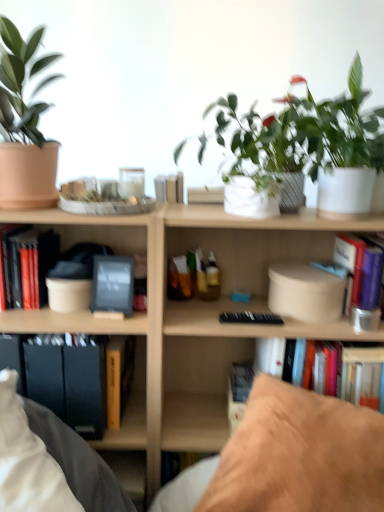
Question: Does green matte plant at upper right, the 2th houseplant when ordered from left to right, lie in front of white matte flowerpot at center?

Choices:
 (A) yes
 (B) no

Answer: (A)

Question: Is green matte plant at upper right, the 2th houseplant when ordered from left to right, taller than white matte flowerpot at center?

Choices:
 (A) no
 (B) yes

Answer: (B)

Question: Is the position of green matte plant at upper right, the 2th houseplant when ordered from left to right, more distant than that of white matte flowerpot at center?

Choices:
 (A) yes
 (B) no

Answer: (B)

Question: Can you confirm if green matte plant at upper right, arranged as the first houseplant when viewed from the right, is smaller than white matte flowerpot at center?

Choices:
 (A) no
 (B) yes

Answer: (A)

Question: Is green matte plant at upper right, the 2th houseplant when ordered from left to right, facing towards white matte flowerpot at center?

Choices:
 (A) no
 (B) yes

Answer: (A)

Question: In the image, is hardcover book at left, positioned as the 1th paperback book in left-to-right order, positioned in front of or behind purple matte book at upper right, which is the second book from left to right?

Choices:
 (A) front
 (B) behind

Answer: (A)

Question: From the image's perspective, is hardcover book at left, which ranks as the third paperback book in right-to-left order, above or below purple matte book at upper right, which is the second book from left to right?

Choices:
 (A) below
 (B) above

Answer: (A)

Question: Based on their sizes in the image, would you say hardcover book at left, which ranks as the third paperback book in right-to-left order, is bigger or smaller than purple matte book at upper right, which is the second book from left to right?

Choices:
 (A) big
 (B) small

Answer: (B)

Question: Choose the correct answer: Is hardcover book at left, positioned as the 1th paperback book in left-to-right order, inside purple matte book at upper right, which is the second book from left to right, or outside it?

Choices:
 (A) inside
 (B) outside

Answer: (B)

Question: From their relative heights in the image, would you say wooden bookcase at center is taller or shorter than matte black folders at lower left?

Choices:
 (A) tall
 (B) short

Answer: (A)

Question: Is point (317, 331) closer or farther from the camera than point (155, 245)?

Choices:
 (A) closer
 (B) farther

Answer: (B)

Question: Considering the positions of wooden bookcase at center and matte black folders at lower left in the image, is wooden bookcase at center wider or thinner than matte black folders at lower left?

Choices:
 (A) thin
 (B) wide

Answer: (B)

Question: Would you say wooden bookcase at center is to the left or to the right of matte black folders at lower left in the picture?

Choices:
 (A) left
 (B) right

Answer: (B)

Question: From a real-world perspective, is white matte flowerpot at center physically located above or below brown suede pillow at lower right?

Choices:
 (A) below
 (B) above

Answer: (B)

Question: Considering the relative positions of white matte flowerpot at center and brown suede pillow at lower right in the image provided, is white matte flowerpot at center to the left or to the right of brown suede pillow at lower right?

Choices:
 (A) left
 (B) right

Answer: (A)